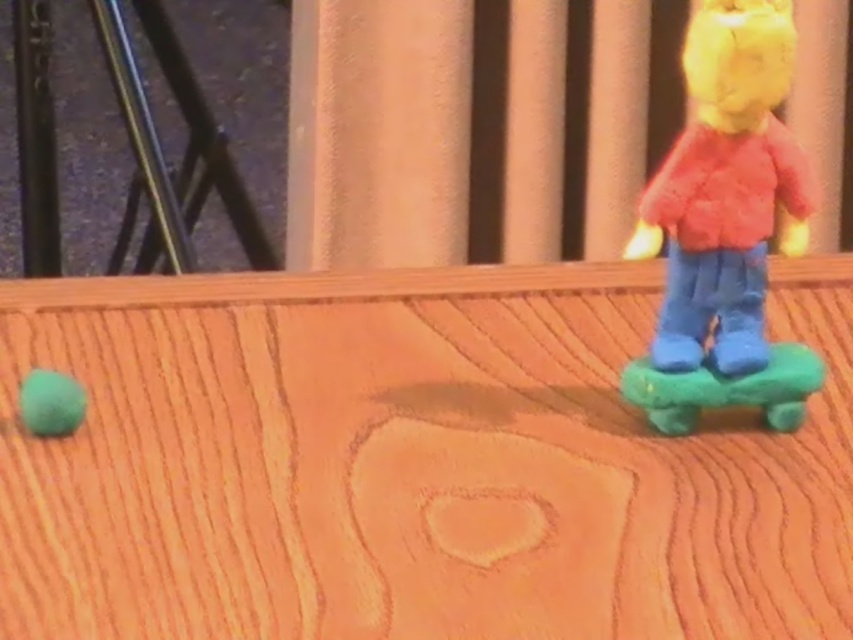
You are trying to place a new sticker on the wooden surface. The matte plastic toy at right and the matte green ball at left are in the way. Which object should you move first to make space?

The matte plastic toy at right is positioned over matte green ball at left. To make space, you should move the matte plastic toy at right first since it is covering the matte green ball at left.

You are organizing a toy storage box and need to fit both the matte plastic toy at right and the green rubber skateboard at right inside. Based on their sizes, which toy should you place first into the box to ensure both fit properly?

The matte plastic toy at right is larger in size than the green rubber skateboard at right, so you should place the matte plastic toy at right first to ensure both fit properly.